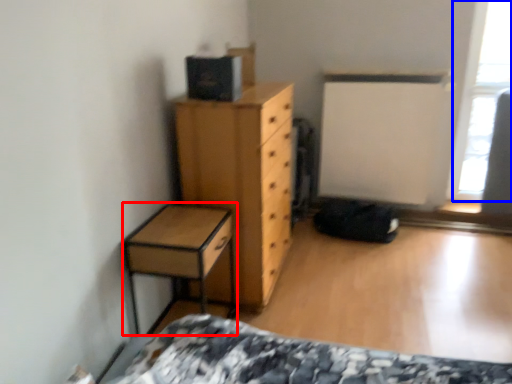
Question: Which point is closer to the camera, nightstand (highlighted by a red box) or window screen (highlighted by a blue box)?

Choices:
 (A) nightstand
 (B) window screen

Answer: (A)